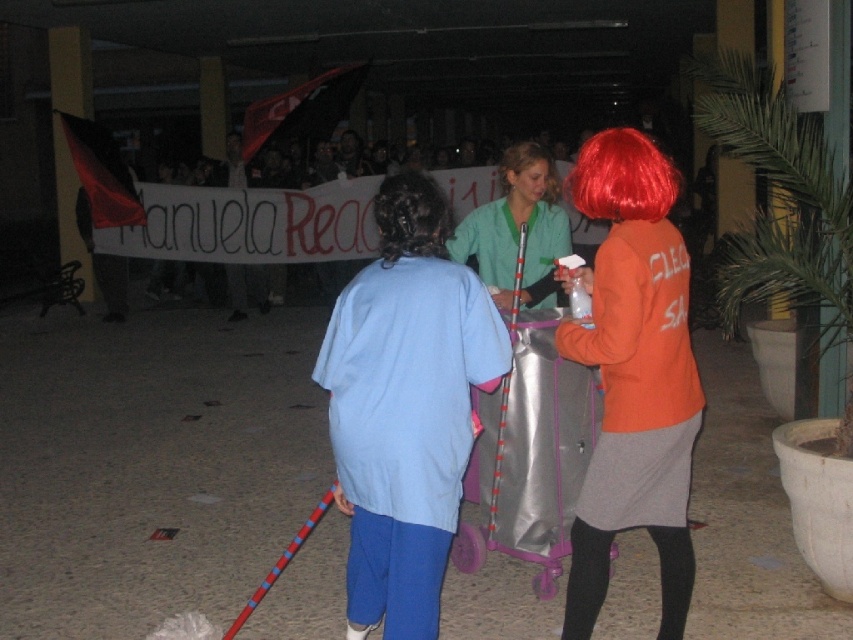
From the picture: You are a photographer trying to capture a photo of the light blue fabric shirt at center and the orange matte jacket at right. From the description, which one is on the left side when looking at the scene?

The light blue fabric shirt at center is positioned on the left side of the orange matte jacket at right.

You are at a nighttime event and want to grab a drink. There is a green smoothie at center and a red synthetic wig at upper right. Which object is bigger?

The green smoothie at center is larger in size than the red synthetic wig at upper right.

You are a delivery person who needs to place a package between the green smoothie at center and the red synthetic wig at upper right. The package requires a space of 4 feet. Can you fit it there?

The green smoothie at center is 4.27 feet away from the red synthetic wig at upper right, so yes, the package can fit between them as the distance is sufficient.